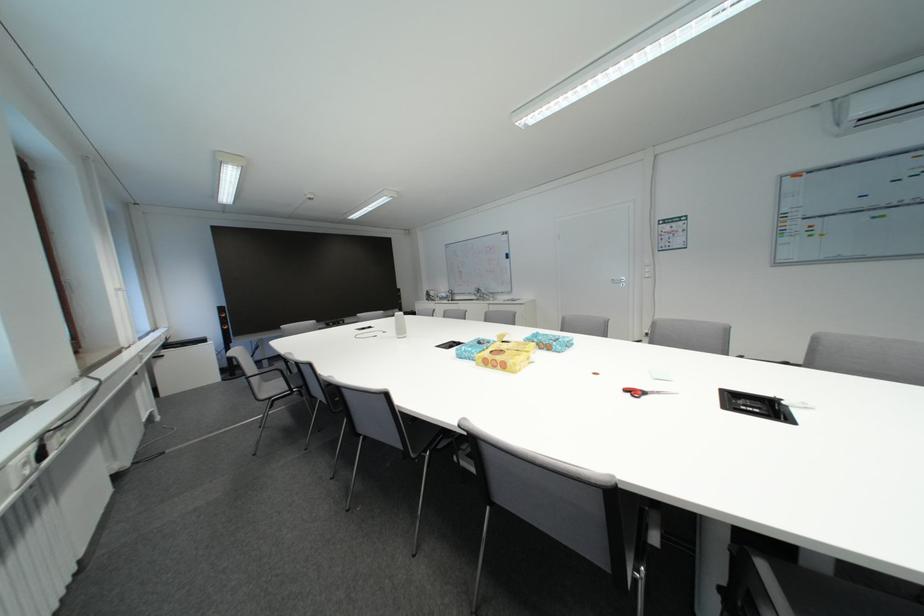
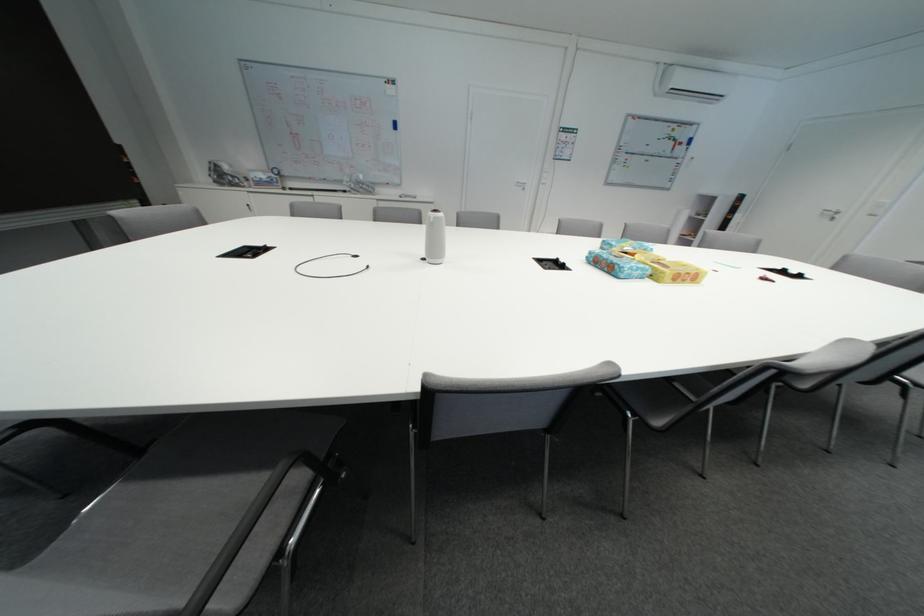
Where in the second image is the point corresponding to the point at 410,334 from the first image?

(444, 254)